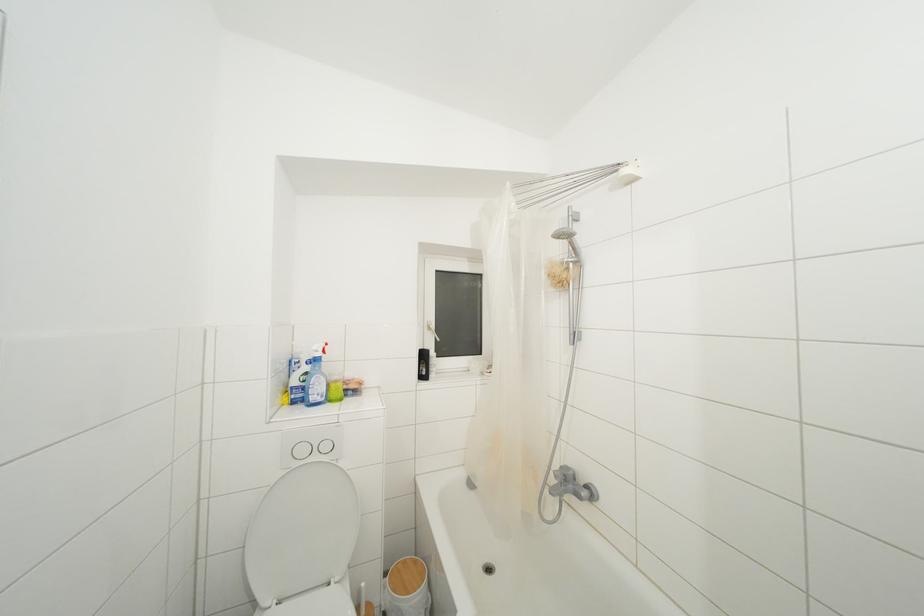
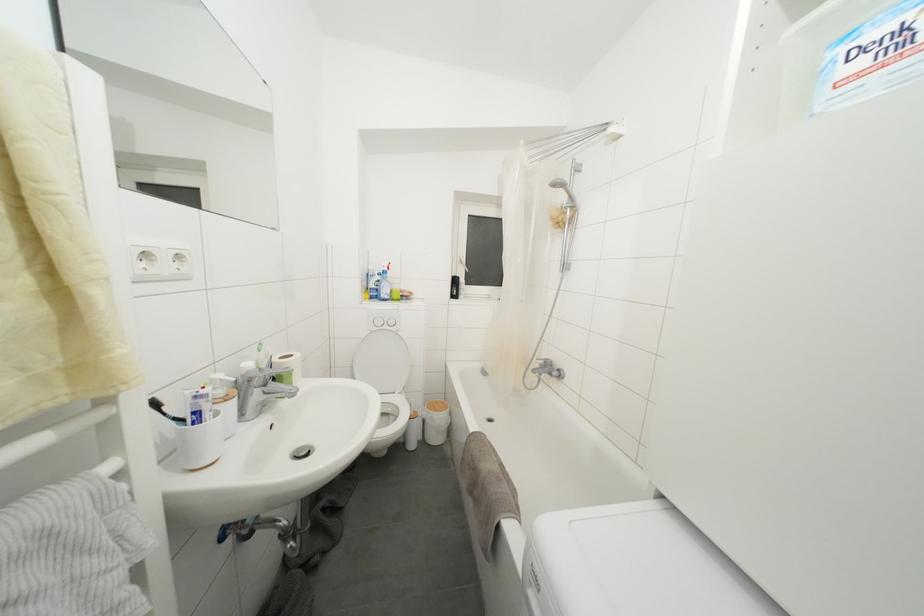
Where in the second image is the point corresponding to (578,254) from the first image?

(575, 200)